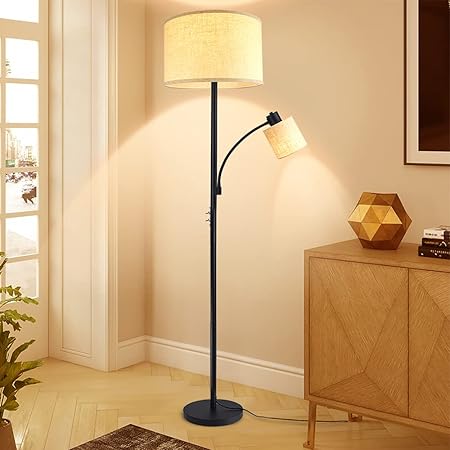
The image size is (450, 450). Find the location of `cable`. cable is located at coordinates (287, 415).